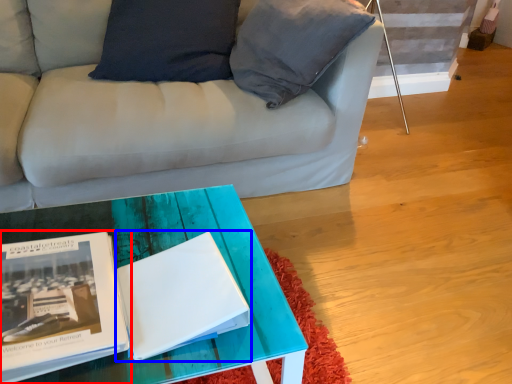
Question: Which object is closer to the camera taking this photo, book (highlighted by a red box) or magazine (highlighted by a blue box)?

Choices:
 (A) book
 (B) magazine

Answer: (A)